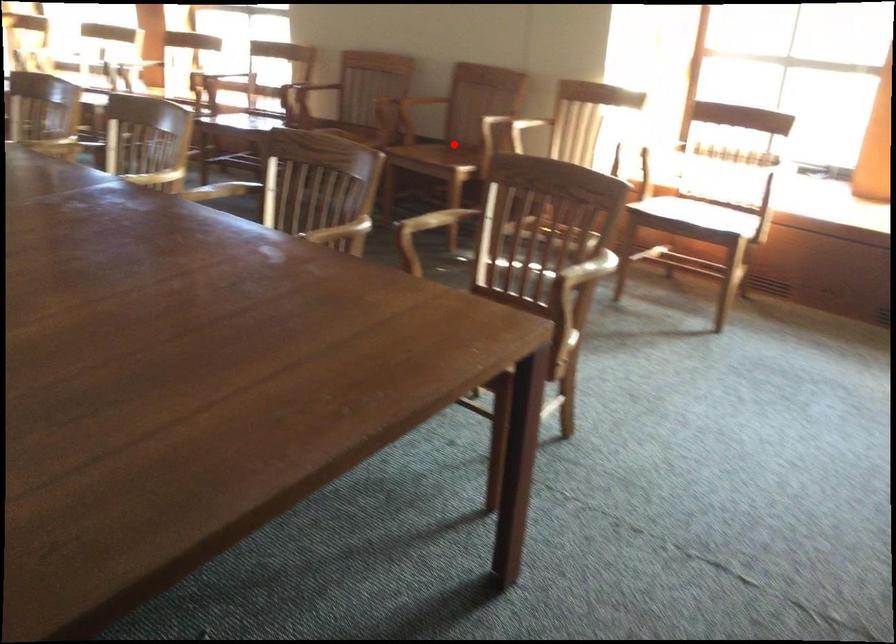
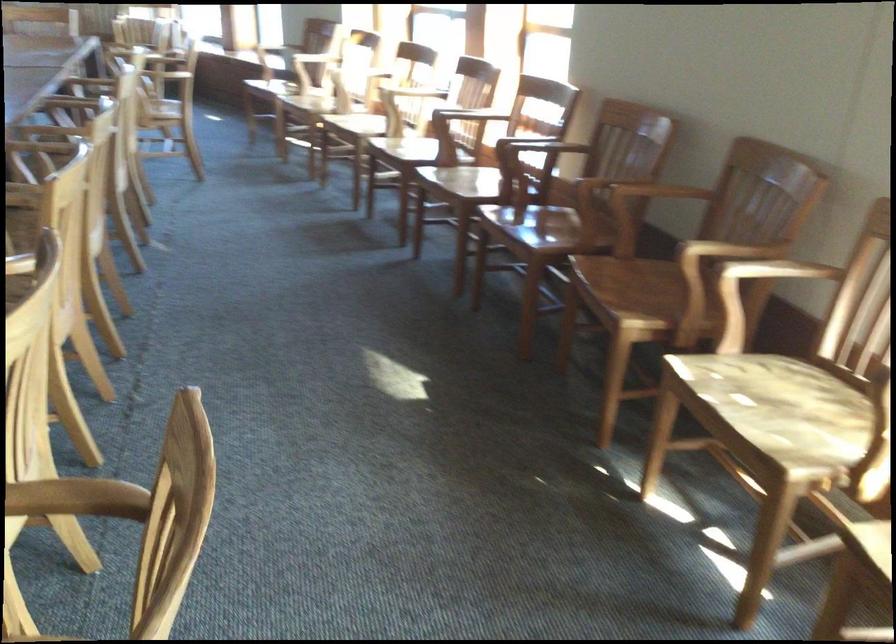
Question: I am providing you with two images of the same scene from different viewpoints. Image1 has a red point marked. In image2, the corresponding 3D location appears at what relative position? Reply with the corresponding letter.

Choices:
 (A) Closer
 (B) Farther

Answer: (A)